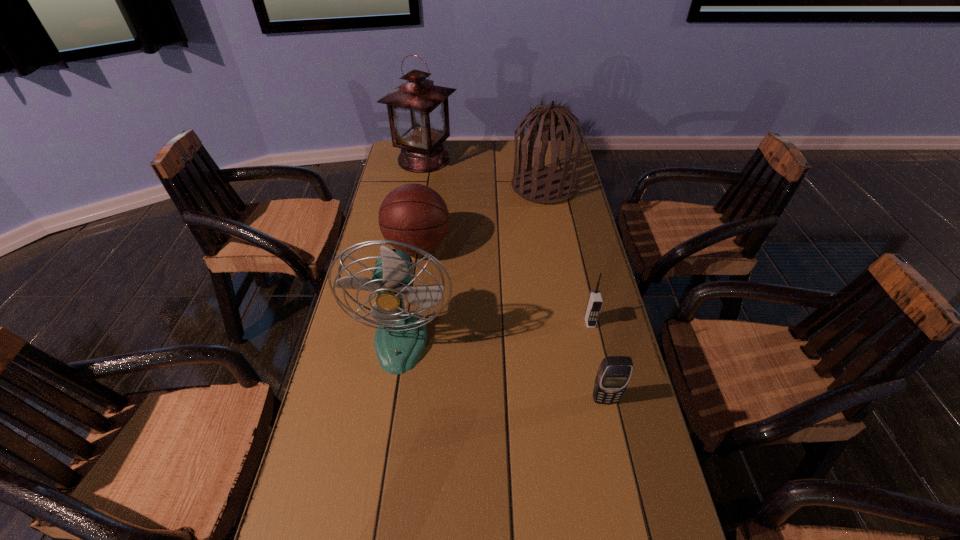
Image resolution: width=960 pixels, height=540 pixels. What are the coordinates of `vacant point that satisfies the following two spatial constraints: 1. on the front side of the oil lamp; 2. on the left side of the basketball` in the screenshot? It's located at (409, 246).